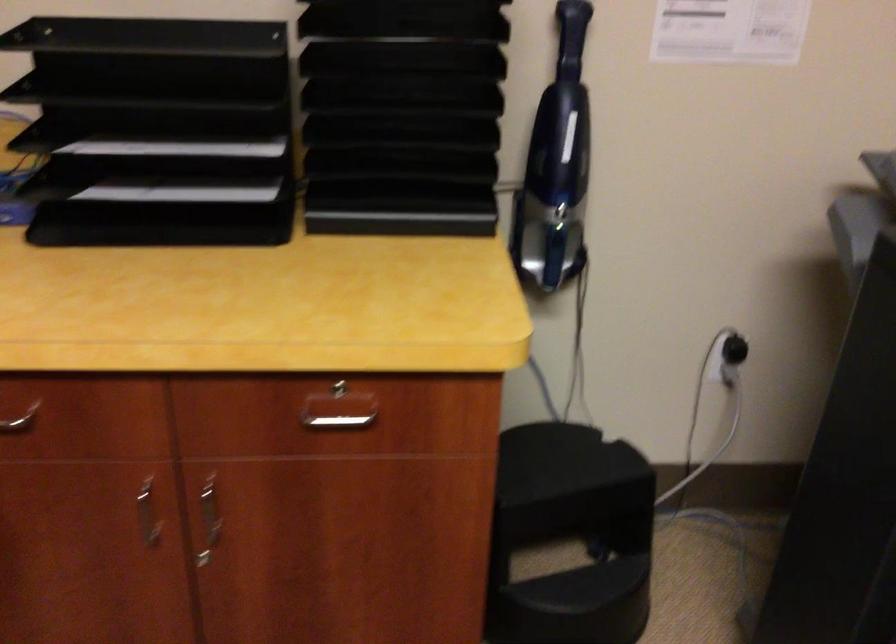
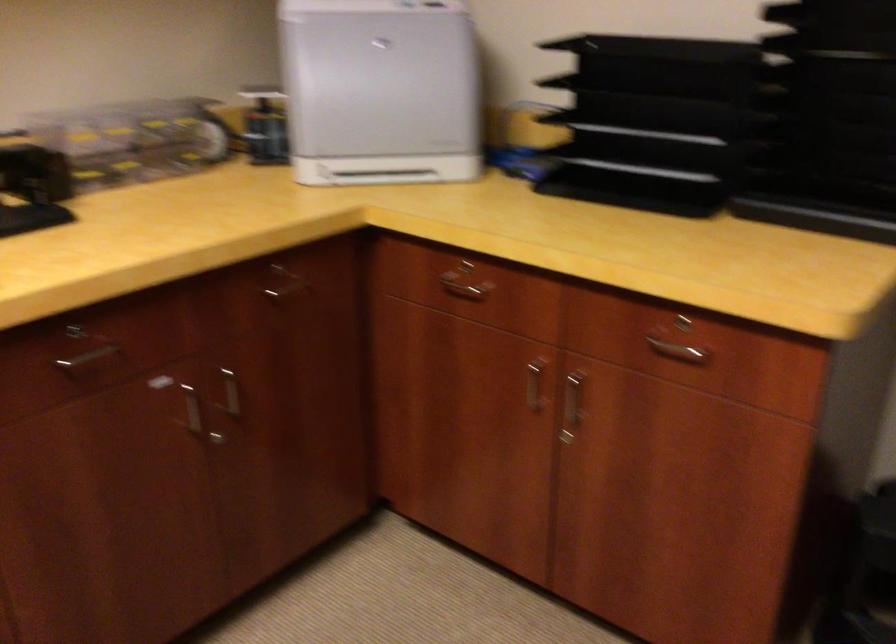
Locate, in the second image, the point that corresponds to the point at 330,418 in the first image.

(677, 351)